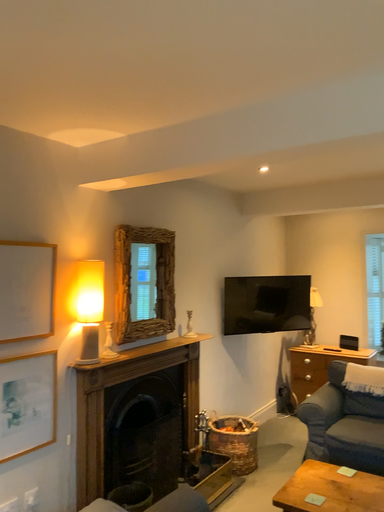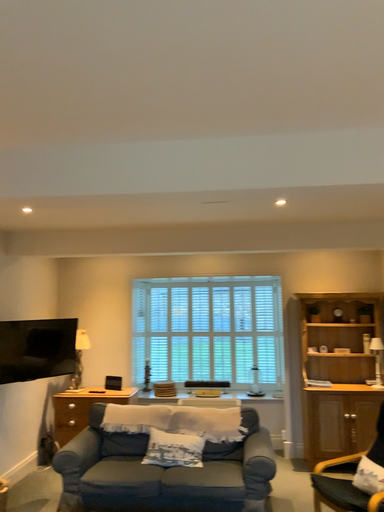
Question: How did the camera likely rotate when shooting the video?

Choices:
 (A) rotated right
 (B) rotated left

Answer: (A)